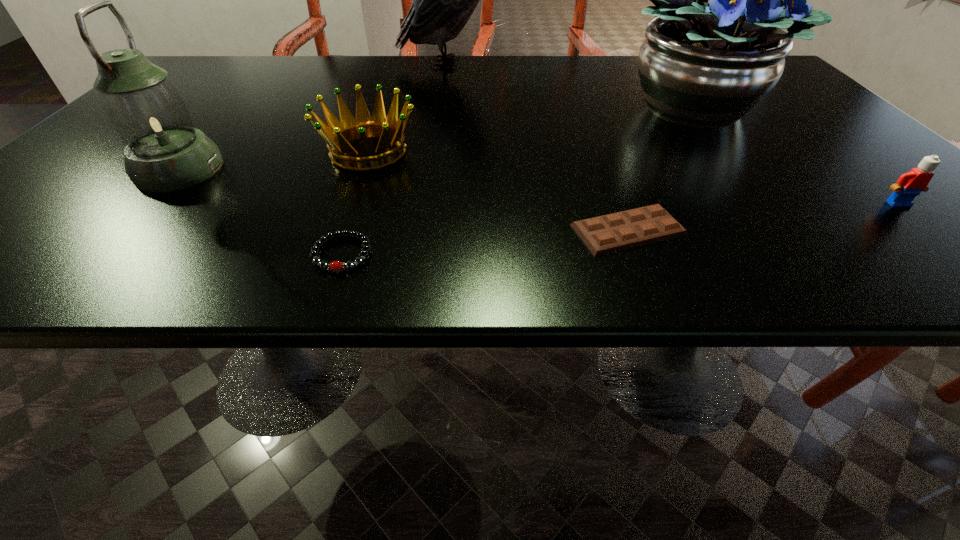
I want to click on free space between the leftmost object and the crown, so click(274, 161).

Where is `free space between the chocolate bar and the lantern`? free space between the chocolate bar and the lantern is located at coordinates (404, 199).

Image resolution: width=960 pixels, height=540 pixels. Identify the location of vacant region between the bouquet and the chocolate bar. (660, 168).

This screenshot has width=960, height=540. In order to click on vacant point located between the leftmost object and the crown in this screenshot , I will do `click(274, 161)`.

Image resolution: width=960 pixels, height=540 pixels. What are the coordinates of `vacant space that is in between the lantern and the bracelet` in the screenshot? It's located at (261, 212).

Where is `the third closest object to the farthest object`? the third closest object to the farthest object is located at coordinates (164, 152).

At what (x,y) coordinates should I click in order to perform the action: click on object identified as the sixth closest to the bracelet. Please return your answer as a coordinate pair (x, y). Looking at the image, I should click on (909, 185).

Locate an element on the screen. This screenshot has height=540, width=960. free location that satisfies the following two spatial constraints: 1. on the back side of the chocolate bar; 2. on the left side of the bracelet is located at coordinates point(350,230).

Identify the location of vacant space that satisfies the following two spatial constraints: 1. on the front-facing side of the tallest object; 2. on the back side of the bouquet. The height and width of the screenshot is (540, 960). (446, 106).